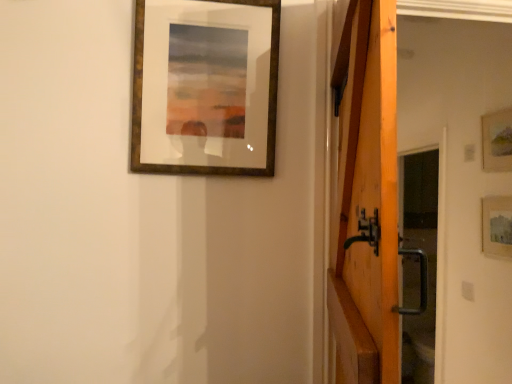
Question: Is matte wooden picture frame at right, marked as the second picture frame in a left-to-right arrangement, outside of wooden barn door at right?

Choices:
 (A) no
 (B) yes

Answer: (B)

Question: Does matte wooden picture frame at right, arranged as the second picture frame when viewed from the right, have a greater height compared to wooden barn door at right?

Choices:
 (A) yes
 (B) no

Answer: (B)

Question: Considering the relative positions of matte wooden picture frame at right, marked as the second picture frame in a left-to-right arrangement, and wooden barn door at right in the image provided, is matte wooden picture frame at right, marked as the second picture frame in a left-to-right arrangement, to the left of wooden barn door at right from the viewer's perspective?

Choices:
 (A) yes
 (B) no

Answer: (B)

Question: Is there a large distance between matte wooden picture frame at right, marked as the second picture frame in a left-to-right arrangement, and wooden barn door at right?

Choices:
 (A) yes
 (B) no

Answer: (A)

Question: Considering the relative sizes of matte wooden picture frame at right, arranged as the second picture frame when viewed from the right, and wooden barn door at right in the image provided, is matte wooden picture frame at right, arranged as the second picture frame when viewed from the right, smaller than wooden barn door at right?

Choices:
 (A) no
 (B) yes

Answer: (B)

Question: In the image, is wooden barn door at right on the left side or the right side of matte wooden picture frame at right, acting as the first picture frame starting from the back?

Choices:
 (A) left
 (B) right

Answer: (A)

Question: From a real-world perspective, relative to matte wooden picture frame at right, acting as the first picture frame starting from the back, is wooden barn door at right vertically above or below?

Choices:
 (A) above
 (B) below

Answer: (A)

Question: From the image's perspective, is wooden barn door at right above or below matte wooden picture frame at right, arranged as the 3th picture frame when viewed from the front?

Choices:
 (A) below
 (B) above

Answer: (B)

Question: Is wooden barn door at right bigger or smaller than matte wooden picture frame at right, acting as the first picture frame starting from the back?

Choices:
 (A) big
 (B) small

Answer: (A)

Question: From a real-world perspective, is wooden frame at upper center, which is the third picture frame in back-to-front order, positioned above or below wooden barn door at right?

Choices:
 (A) above
 (B) below

Answer: (A)

Question: In terms of size, does wooden frame at upper center, the 3th picture frame when ordered from right to left, appear bigger or smaller than wooden barn door at right?

Choices:
 (A) small
 (B) big

Answer: (A)

Question: Is wooden frame at upper center, placed as the first picture frame when sorted from left to right, inside or outside of wooden barn door at right?

Choices:
 (A) outside
 (B) inside

Answer: (A)

Question: Is wooden frame at upper center, which is the first picture frame in front-to-back order, in front of or behind wooden barn door at right in the image?

Choices:
 (A) front
 (B) behind

Answer: (B)

Question: Is wooden barn door at right in front of or behind wooden picture frame at upper right, arranged as the second picture frame when viewed from the front, in the image?

Choices:
 (A) behind
 (B) front

Answer: (B)

Question: Would you say wooden barn door at right is inside or outside wooden picture frame at upper right, which ranks as the second picture frame in back-to-front order?

Choices:
 (A) inside
 (B) outside

Answer: (B)